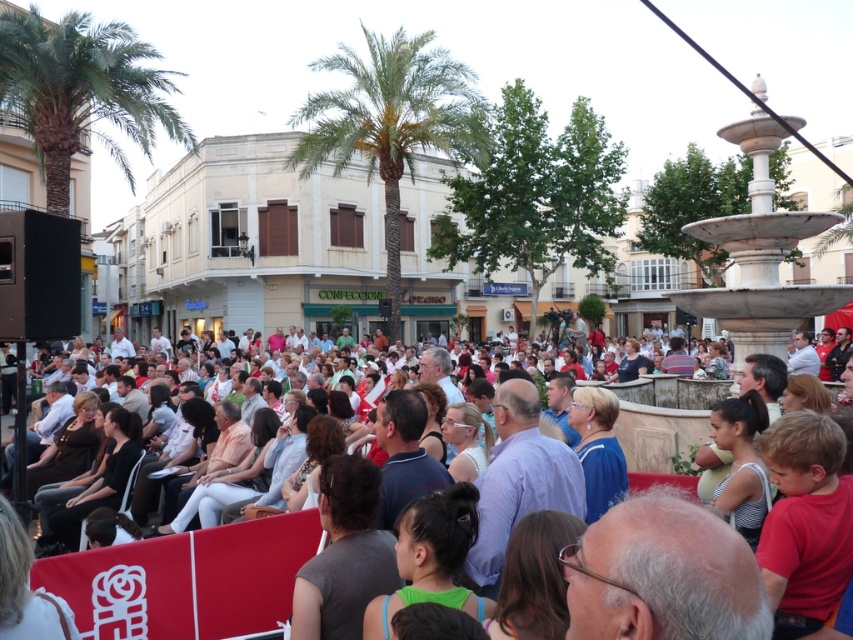
Which is behind, point (128, 602) or point (792, 218)?

The point (792, 218) is behind.

Locate an element on the screen. The image size is (853, 640). matte white crowd at center is located at coordinates coord(178,586).

Does point (218, 627) come farther from viewer compared to point (689, 228)?

No.

Locate an element on the screen. matte white crowd at center is located at coordinates (178, 586).

Is green leafy palm tree at center taller than white marble fountain at right?

Indeed, green leafy palm tree at center has a greater height compared to white marble fountain at right.

Between green leafy palm tree at center and white marble fountain at right, which one has less height?

white marble fountain at right

Where is `green leafy palm tree at center`? Image resolution: width=853 pixels, height=640 pixels. green leafy palm tree at center is located at coordinates (390, 124).

This screenshot has height=640, width=853. I want to click on green leafy palm tree at center, so [x=390, y=124].

Does green leafy palm tree at upper left appear on the left side of matte white crowd at center?

Correct, you'll find green leafy palm tree at upper left to the left of matte white crowd at center.

Who is positioned more to the right, green leafy palm tree at upper left or matte white crowd at center?

matte white crowd at center

Describe the element at coordinates (80, 88) in the screenshot. I see `green leafy palm tree at upper left` at that location.

Find the location of a particular element. This screenshot has width=853, height=640. green leafy palm tree at upper left is located at coordinates (80, 88).